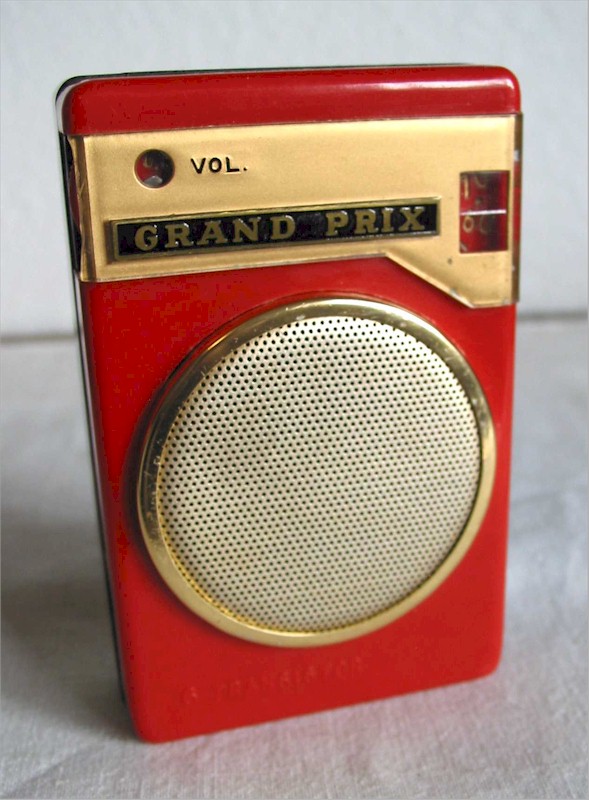
The width and height of the screenshot is (589, 800). Identify the location of control buttons. (155, 172), (486, 193), (487, 222).